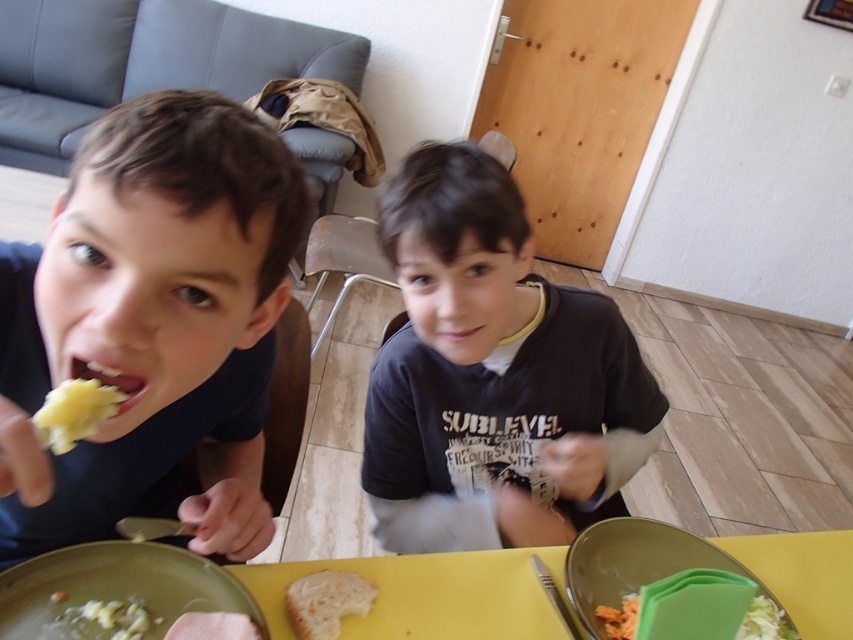
Does point (556, 576) lie behind point (663, 579)?

Yes, point (556, 576) is farther from viewer.

Is yellow matte table at center thinner than green plastic fork at lower right?

Incorrect, yellow matte table at center's width is not less than green plastic fork at lower right's.

Locate an element on the screen. This screenshot has height=640, width=853. yellow matte table at center is located at coordinates (428, 595).

Locate an element on the screen. The height and width of the screenshot is (640, 853). yellow matte table at center is located at coordinates (428, 595).

Can you confirm if yellow matte table at center is positioned to the right of white matte bread at lower center?

Yes, yellow matte table at center is to the right of white matte bread at lower center.

Can you confirm if yellow matte table at center is thinner than white matte bread at lower center?

In fact, yellow matte table at center might be wider than white matte bread at lower center.

At what (x,y) coordinates should I click in order to perform the action: click on yellow matte table at center. Please return your answer as a coordinate pair (x, y). Image resolution: width=853 pixels, height=640 pixels. Looking at the image, I should click on (428, 595).

This screenshot has height=640, width=853. Find the location of `yellow matte table at center`. yellow matte table at center is located at coordinates (428, 595).

Is dark blue t-shirt at center below pink matte skin at center?

Yes.

Who is more distant from viewer, (575, 296) or (457, 314)?

The point (575, 296) is behind.

Find the location of `dark blue t-shirt at center`. dark blue t-shirt at center is located at coordinates (492, 376).